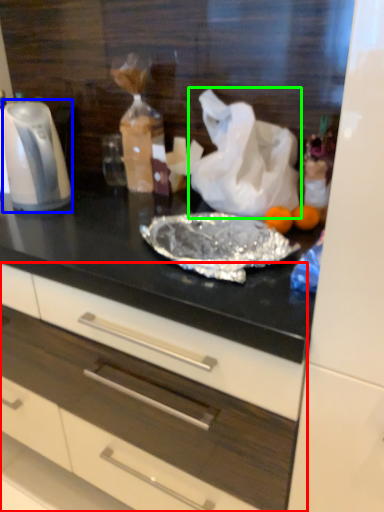
Question: Based on their relative distances, which object is farther from drawer (highlighted by a red box)? Choose from kitchen appliance (highlighted by a blue box) and plastic bag (highlighted by a green box).

Choices:
 (A) kitchen appliance
 (B) plastic bag

Answer: (B)